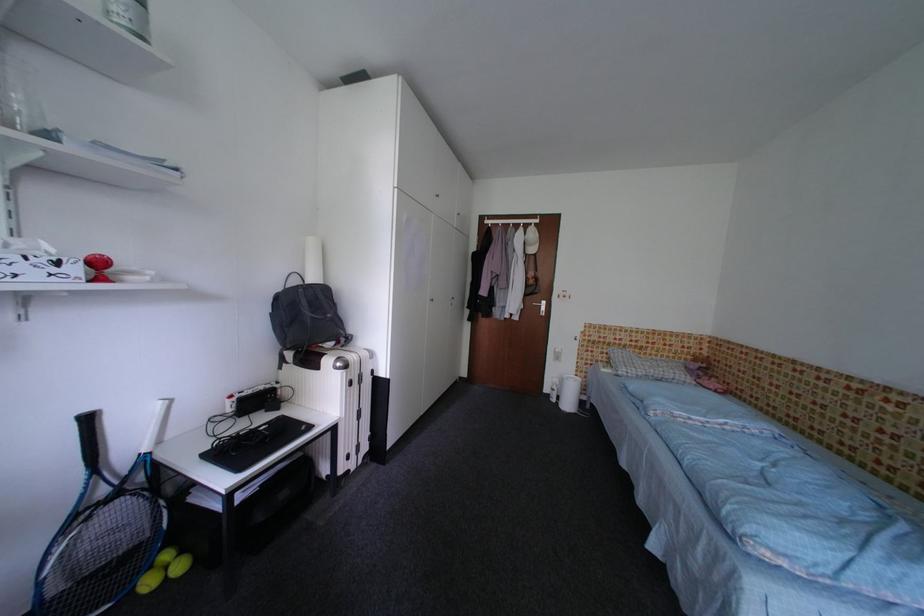
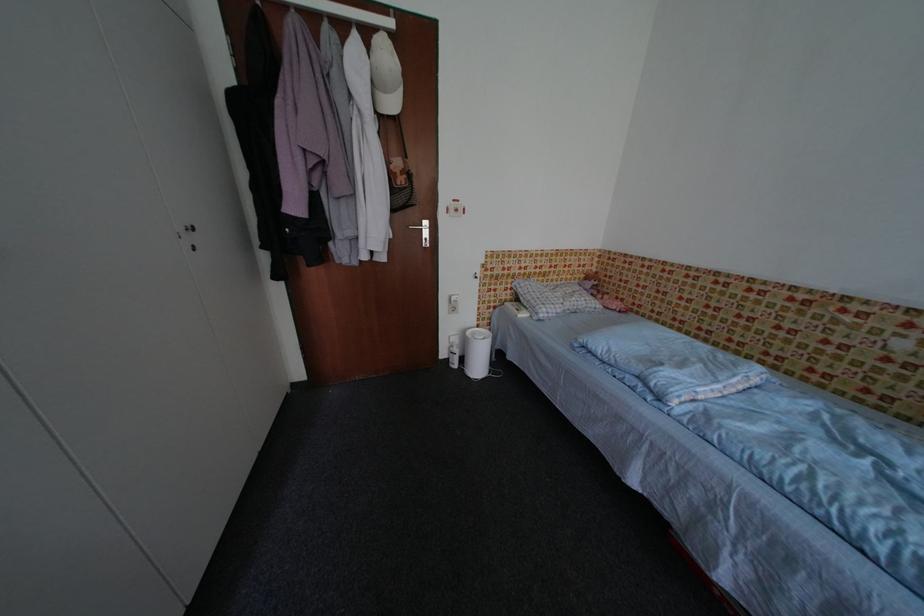
Where in the second image is the point corresponding to [564,383] from the first image?

(464, 342)